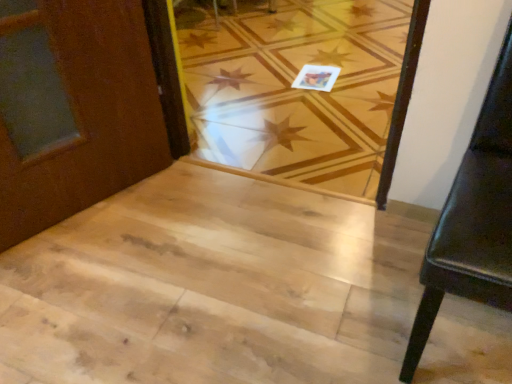
The image size is (512, 384). In order to click on vacant space behind black leather chair at right in this screenshot , I will do [362, 225].